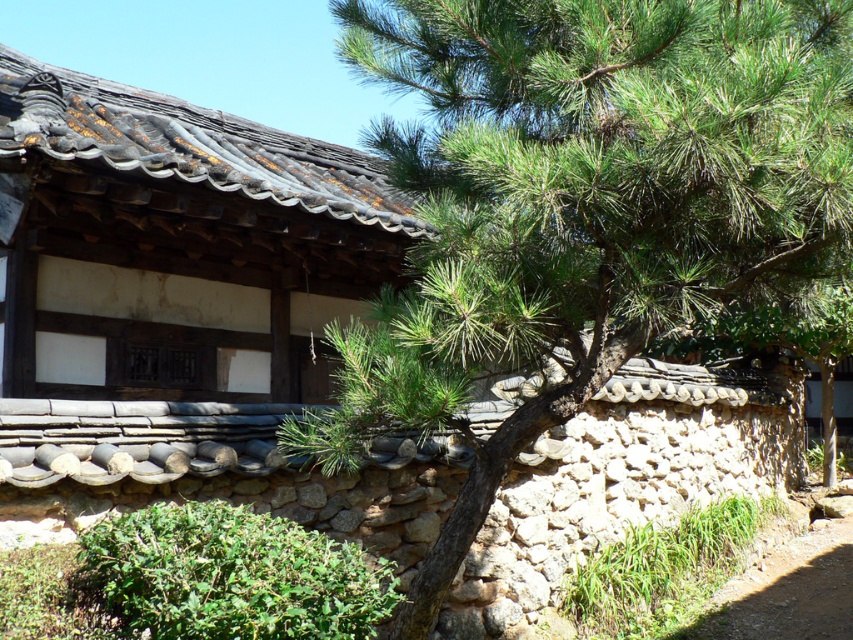
Who is lower down, green needle-like leaves at center or dirt path at lower right?

Positioned lower is dirt path at lower right.

Which is behind, point (630, 266) or point (814, 550)?

Positioned behind is point (814, 550).

In order to click on green needle-like leaves at center in this screenshot , I will do `click(579, 209)`.